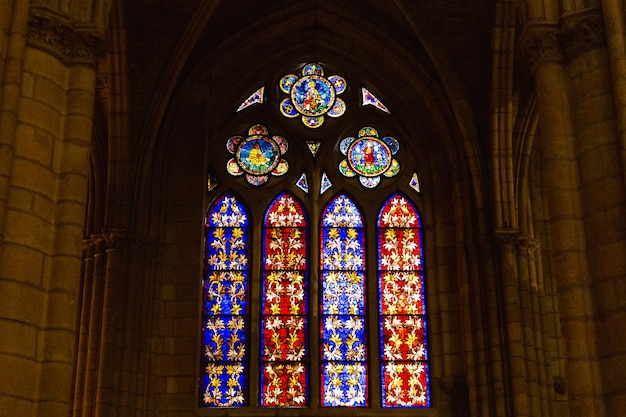
In order to click on columns in this screenshot , I will do `click(18, 172)`, `click(588, 172)`.